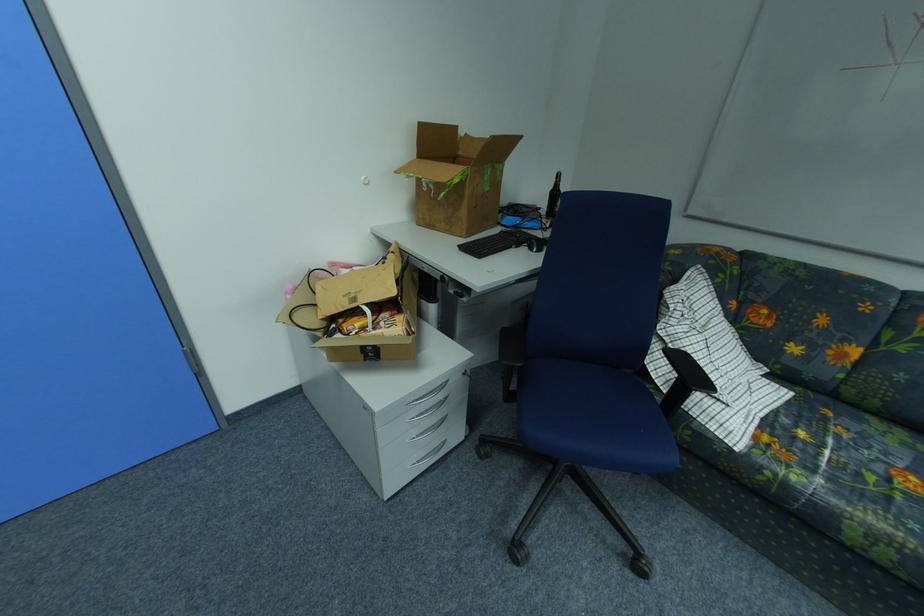
The image size is (924, 616). Find the location of `sofa sitting surface`. sofa sitting surface is located at coordinates (833, 452).